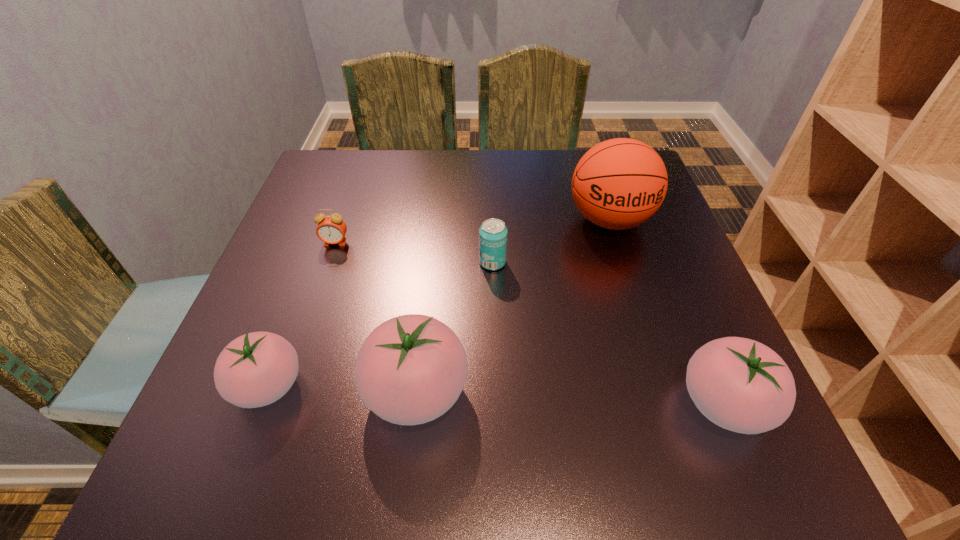
If equal spacing is desired by inserting an extra tomato among them, please point out a free spot for this new tomato. Please provide its 2D coordinates. Your answer should be formatted as a tuple, i.e. [(x, y)], where the tuple contains the x and y coordinates of a point satisfying the conditions above.

[(568, 397)]